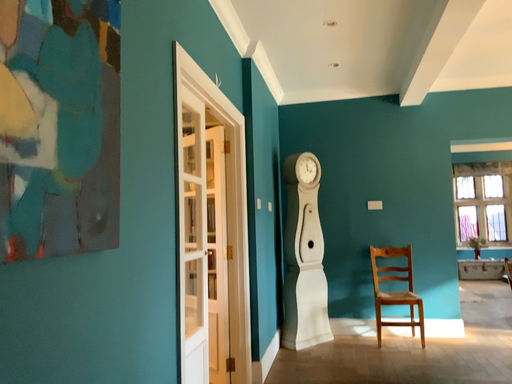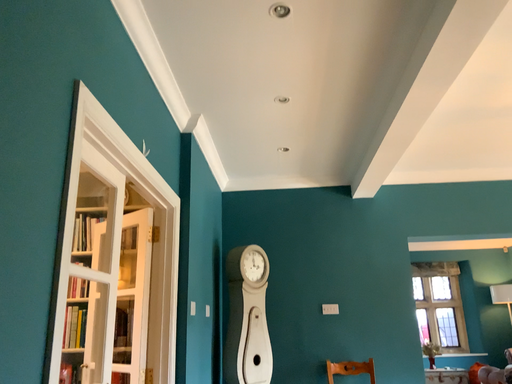
Question: How did the camera likely rotate when shooting the video?

Choices:
 (A) rotated right
 (B) rotated left

Answer: (A)